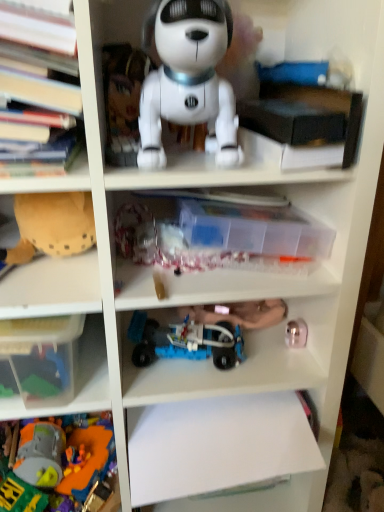
Question: Looking at the image, does metallic gold toy at lower right, marked as the third toy in a bottom-to-top arrangement, seem bigger or smaller compared to brown fabric toy at left, the fourth toy positioned from the bottom?

Choices:
 (A) big
 (B) small

Answer: (B)

Question: Looking at their shapes, would you say metallic gold toy at lower right, marked as the third toy in a bottom-to-top arrangement, is wider or thinner than brown fabric toy at left, the fourth toy positioned from the bottom?

Choices:
 (A) wide
 (B) thin

Answer: (B)

Question: Which object is positioned closest to the plastic orange and gray toy at lower left, arranged as the 1th toy when ordered from the bottom?

Choices:
 (A) transparent plastic container at center, arranged as the second book when viewed from the left
 (B) black matte book at upper right, marked as the 3th book in a left-to-right arrangement
 (C) white plastic drawer at center
 (D) white matte robot dog at upper center, arranged as the 5th toy when ordered from the bottom
 (E) metallic gold toy at lower right, marked as the third toy in a bottom-to-top arrangement

Answer: (C)

Question: Estimate the real-world distances between objects in this image. Which object is closer to the white plastic drawer at center?

Choices:
 (A) brown fabric toy at left, the fourth toy positioned from the bottom
 (B) black matte book at upper right, the first book when ordered from right to left
 (C) white matte robot dog at upper center, arranged as the 5th toy when ordered from the bottom
 (D) metallic gold toy at lower right, positioned as the 3th toy in top-to-bottom order
 (E) hardcover books at left, which is counted as the 1th book, starting from the left

Answer: (D)